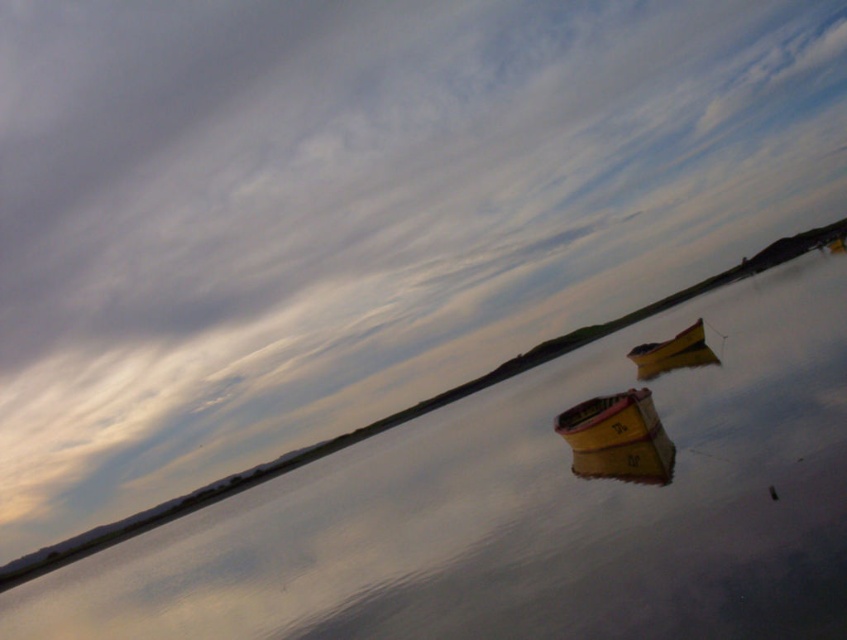
Can you confirm if yellow matte boat at center is shorter than yellow matte boat at center-right?

Indeed, yellow matte boat at center has a lesser height compared to yellow matte boat at center-right.

Describe the element at coordinates (607, 420) in the screenshot. I see `yellow matte boat at center` at that location.

You are a GUI agent. You are given a task and a screenshot of the screen. Output one action in this format:
    pyautogui.click(x=<x>, y=<y>)
    Task: Click on the yellow matte boat at center
    The height and width of the screenshot is (640, 847).
    Given the screenshot: What is the action you would take?
    pyautogui.click(x=607, y=420)

Does smooth reflective water at center appear on the right side of yellow matte boat at center-right?

In fact, smooth reflective water at center is to the left of yellow matte boat at center-right.

Consider the image. Which of these two, smooth reflective water at center or yellow matte boat at center-right, stands taller?

With more height is smooth reflective water at center.

Is point (821, 541) closer to viewer compared to point (667, 349)?

Yes, point (821, 541) is in front of point (667, 349).

Identify the location of smooth reflective water at center. (530, 508).

Does smooth reflective water at center lie in front of yellow matte boat at center?

Yes, smooth reflective water at center is in front of yellow matte boat at center.

Between smooth reflective water at center and yellow matte boat at center, which one is positioned higher?

Positioned higher is yellow matte boat at center.

At what (x,y) coordinates should I click in order to perform the action: click on smooth reflective water at center. Please return your answer as a coordinate pair (x, y). Image resolution: width=847 pixels, height=640 pixels. Looking at the image, I should click on (530, 508).